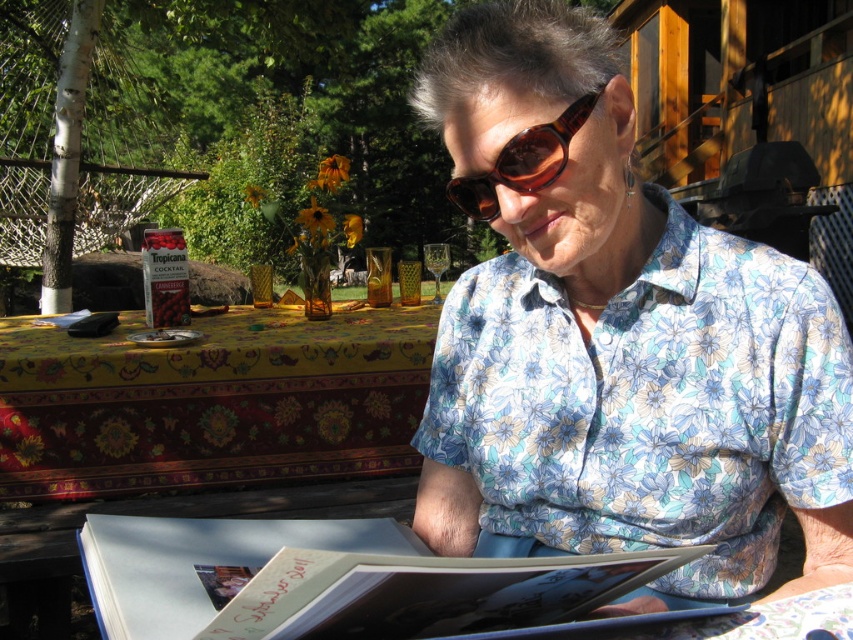
Question: Which point is closer to the camera?

Choices:
 (A) (593, 29)
 (B) (489, 220)

Answer: (A)

Question: Which object is positioned farthest from the yellow floral fabric at upper left?

Choices:
 (A) light blue paper book at center
 (B) brown tortoiseshell sunglasses at center
 (C) floral cotton shirt at center

Answer: (A)

Question: Is the position of floral cotton shirt at center less distant than that of light blue paper book at center?

Choices:
 (A) no
 (B) yes

Answer: (A)

Question: Is light blue paper book at center positioned behind brown tortoiseshell sunglasses at center?

Choices:
 (A) yes
 (B) no

Answer: (B)

Question: Which object appears closest to the camera in this image?

Choices:
 (A) yellow floral fabric at upper left
 (B) brown tortoiseshell sunglasses at center

Answer: (B)

Question: Is light blue paper book at center positioned at the back of brown tortoiseshell sunglasses at center?

Choices:
 (A) no
 (B) yes

Answer: (A)